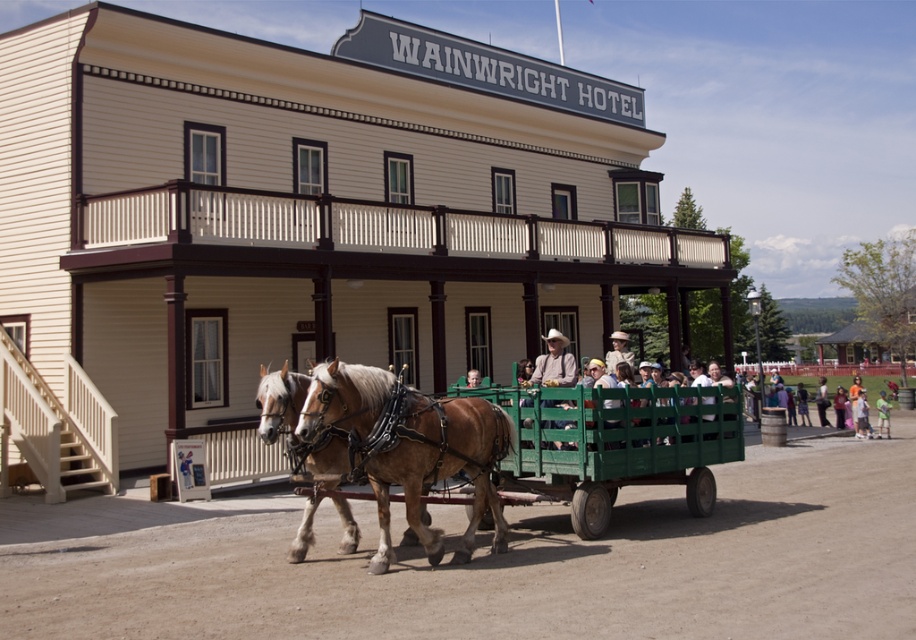
Who is positioned more to the left, matte brown cowboy hat at center or light blue denim shirt at lower right?

matte brown cowboy hat at center is more to the left.

Does matte brown cowboy hat at center have a lesser height compared to light blue denim shirt at lower right?

Indeed, matte brown cowboy hat at center has a lesser height compared to light blue denim shirt at lower right.

Is point (548, 339) positioned before point (887, 413)?

Yes, point (548, 339) is closer to viewer.

Locate an element on the screen. matte brown cowboy hat at center is located at coordinates (554, 362).

Does orange cotton shirt at lower right have a lesser height compared to light blue denim shirt at lower right?

Indeed, orange cotton shirt at lower right has a lesser height compared to light blue denim shirt at lower right.

Is orange cotton shirt at lower right in front of light blue denim shirt at lower right?

Yes, orange cotton shirt at lower right is in front of light blue denim shirt at lower right.

Locate an element on the screen. The image size is (916, 640). orange cotton shirt at lower right is located at coordinates pyautogui.click(x=860, y=417).

Describe the element at coordinates (410, 448) in the screenshot. The width and height of the screenshot is (916, 640). I see `light brown leather horse at center` at that location.

The image size is (916, 640). In order to click on light brown leather horse at center in this screenshot , I will do `click(410, 448)`.